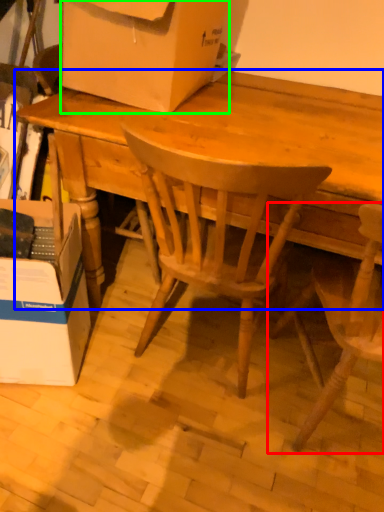
Question: Estimate the real-world distances between objects in this image. Which object is closer to chair (highlighted by a red box), desk (highlighted by a blue box) or box (highlighted by a green box)?

Choices:
 (A) desk
 (B) box

Answer: (A)